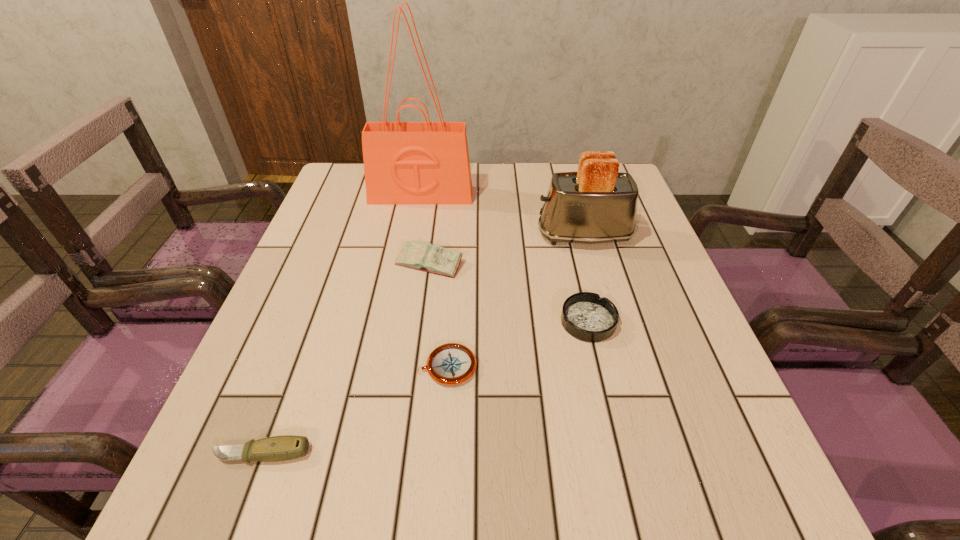
Find the location of `vacant space that is in between the toaster and the diary`. vacant space that is in between the toaster and the diary is located at coordinates (507, 249).

Find the location of a particular element. The height and width of the screenshot is (540, 960). free point between the diary and the nearest object is located at coordinates (346, 359).

Where is `free space between the farthest object and the fifth farthest object`? The height and width of the screenshot is (540, 960). free space between the farthest object and the fifth farthest object is located at coordinates (434, 281).

This screenshot has width=960, height=540. In order to click on empty space that is in between the fifth shortest object and the shortest object in this screenshot , I will do `click(516, 301)`.

The height and width of the screenshot is (540, 960). I want to click on empty space between the tallest object and the ashtray, so click(x=505, y=259).

Locate an element on the screen. Image resolution: width=960 pixels, height=540 pixels. empty space that is in between the second tallest object and the fifth farthest object is located at coordinates (516, 301).

Locate an element on the screen. vacant area that lies between the tote bag and the diary is located at coordinates (425, 229).

Where is `the fourth closest object relative to the tote bag`? the fourth closest object relative to the tote bag is located at coordinates (450, 364).

Identify which object is the fourth nearest to the nearest object. Please provide its 2D coordinates. Your answer should be formatted as a tuple, i.e. [(x, y)], where the tuple contains the x and y coordinates of a point satisfying the conditions above.

[(598, 204)]

Find the location of a particular element. Image resolution: width=960 pixels, height=540 pixels. free space in the image that satisfies the following two spatial constraints: 1. on the logo side of the farthest object; 2. on the right side of the third nearest object is located at coordinates (398, 322).